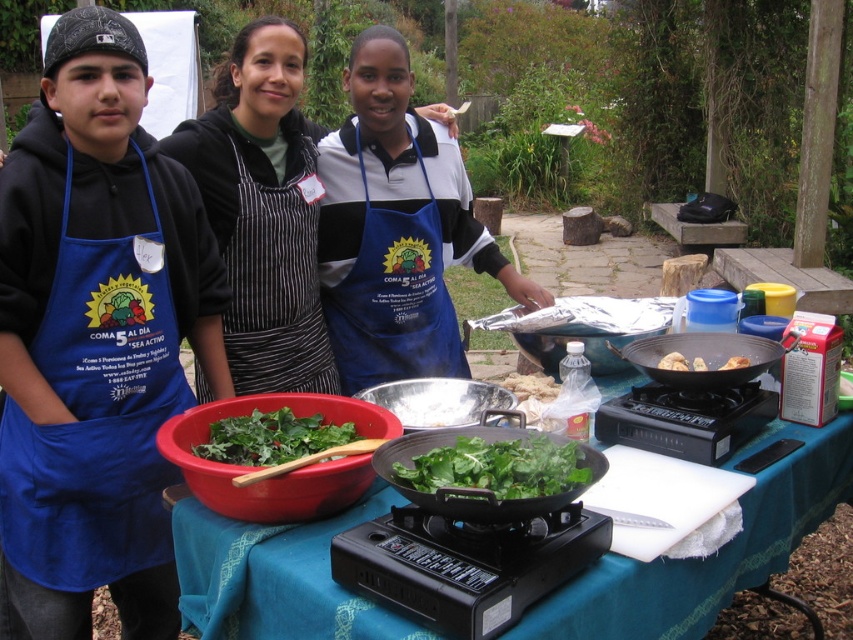
Question: Is blue apron at center to the left of black striped apron at center from the viewer's perspective?

Choices:
 (A) yes
 (B) no

Answer: (B)

Question: Does blue fabric tablecloth at center have a larger size compared to blue apron at center?

Choices:
 (A) yes
 (B) no

Answer: (A)

Question: Is blue apron at center closer to the viewer compared to blue fabric apron at center?

Choices:
 (A) no
 (B) yes

Answer: (B)

Question: Which of the following is the closest to the observer?

Choices:
 (A) green leafy vegetable at center
 (B) black striped apron at center
 (C) blue fabric apron at center

Answer: (A)

Question: Which object appears closest to the camera in this image?

Choices:
 (A) green leafy vegetable at center
 (B) green leafymaterial/texturevegetable at center
 (C) blue fabric apron at center
 (D) white crumbly food at center

Answer: (A)

Question: Estimate the real-world distances between objects in this image. Which object is closer to the blue fabric apron at center?

Choices:
 (A) blue fabric tablecloth at center
 (B) black striped apron at center

Answer: (B)